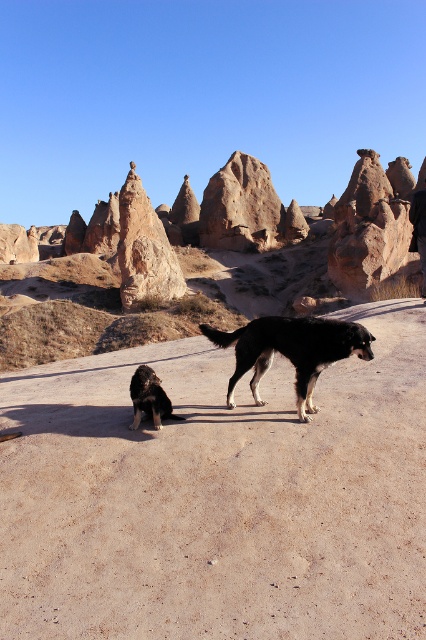
Does brown sandy dirt track at center appear on the left side of black fur dog at lower left?

Incorrect, brown sandy dirt track at center is not on the left side of black fur dog at lower left.

You are a GUI agent. You are given a task and a screenshot of the screen. Output one action in this format:
    pyautogui.click(x=<x>, y=<y>)
    Task: Click on the brown sandy dirt track at center
    The width and height of the screenshot is (426, 640).
    Given the screenshot: What is the action you would take?
    pyautogui.click(x=218, y=497)

Where is `brown sandy dirt track at center`? This screenshot has width=426, height=640. brown sandy dirt track at center is located at coordinates (218, 497).

Which of these two, coral sandstone rock formation at upper center or black fur dog at center, stands shorter?

With less height is black fur dog at center.

Identify the location of coral sandstone rock formation at upper center. This screenshot has width=426, height=640. (371, 225).

In order to click on coral sandstone rock formation at upper center in this screenshot , I will do `click(371, 225)`.

Which is below, coral sandstone rock formation at upper center or black leather pants at center?

black leather pants at center

Is coral sandstone rock formation at upper center to the right of black leather pants at center from the viewer's perspective?

Correct, you'll find coral sandstone rock formation at upper center to the right of black leather pants at center.

The image size is (426, 640). Identify the location of coral sandstone rock formation at upper center. (371, 225).